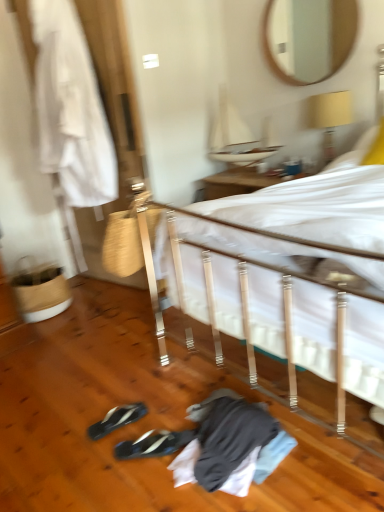
Question: Considering the relative sizes of white fabric at left and wooden mirror at upper center in the image provided, is white fabric at left shorter than wooden mirror at upper center?

Choices:
 (A) yes
 (B) no

Answer: (B)

Question: Can you confirm if white fabric at left is bigger than wooden mirror at upper center?

Choices:
 (A) no
 (B) yes

Answer: (B)

Question: Is white fabric at left turned away from wooden mirror at upper center?

Choices:
 (A) no
 (B) yes

Answer: (A)

Question: Considering the relative positions of white fabric at left and wooden mirror at upper center in the image provided, is white fabric at left to the left of wooden mirror at upper center from the viewer's perspective?

Choices:
 (A) no
 (B) yes

Answer: (B)

Question: Considering the relative sizes of white fabric at left and wooden mirror at upper center in the image provided, is white fabric at left smaller than wooden mirror at upper center?

Choices:
 (A) yes
 (B) no

Answer: (B)

Question: Is white fabric at left positioned beyond the bounds of wooden mirror at upper center?

Choices:
 (A) no
 (B) yes

Answer: (B)

Question: Is the position of white fabric at left more distant than that of black synthetic sneakers at lower center, arranged as the 1th footwear when viewed from the front?

Choices:
 (A) yes
 (B) no

Answer: (A)

Question: Are white fabric at left and black synthetic sneakers at lower center, the second footwear in the back-to-front sequence, making contact?

Choices:
 (A) yes
 (B) no

Answer: (B)

Question: Does white fabric at left turn towards black synthetic sneakers at lower center, the second footwear in the back-to-front sequence?

Choices:
 (A) yes
 (B) no

Answer: (B)

Question: Is white fabric at left shorter than black synthetic sneakers at lower center, arranged as the 1th footwear when viewed from the front?

Choices:
 (A) no
 (B) yes

Answer: (A)

Question: Is white fabric at left thinner than black synthetic sneakers at lower center, arranged as the 1th footwear when viewed from the front?

Choices:
 (A) no
 (B) yes

Answer: (A)

Question: Is white fabric at left positioned beyond the bounds of black synthetic sneakers at lower center, arranged as the 1th footwear when viewed from the front?

Choices:
 (A) no
 (B) yes

Answer: (B)

Question: Considering the relative sizes of white fabric bed at center and wooden mirror at upper center in the image provided, is white fabric bed at center shorter than wooden mirror at upper center?

Choices:
 (A) no
 (B) yes

Answer: (A)